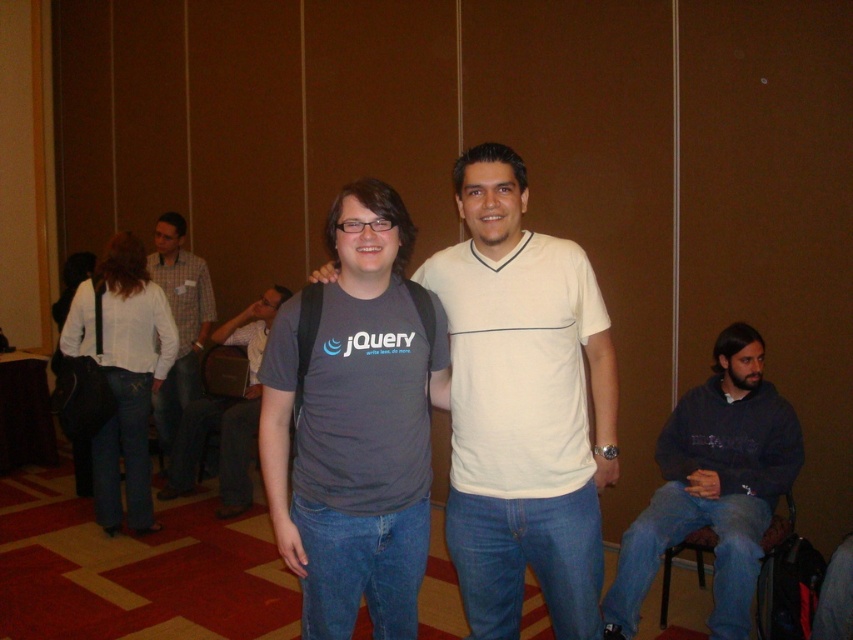
You are attending a conference and need to sit down. You see a white shirt at left and a brown fabric chair at lower right. Which object is closer to your current position if you are facing the scene?

The white shirt at left is closer to your current position because it is positioned to the left of the brown fabric chair at lower right, which is further to the right side of the scene.

You are a photographer setting up a shoot in this room. You need to ensure that the gray fabric shirt at center is visible above the brown fabric chair at lower right in the final photo. Based on their heights, will this be possible?

The gray fabric shirt at center is taller than the brown fabric chair at lower right, so yes, the photographer can position the camera such that the gray fabric shirt at center is visible above the brown fabric chair at lower right.